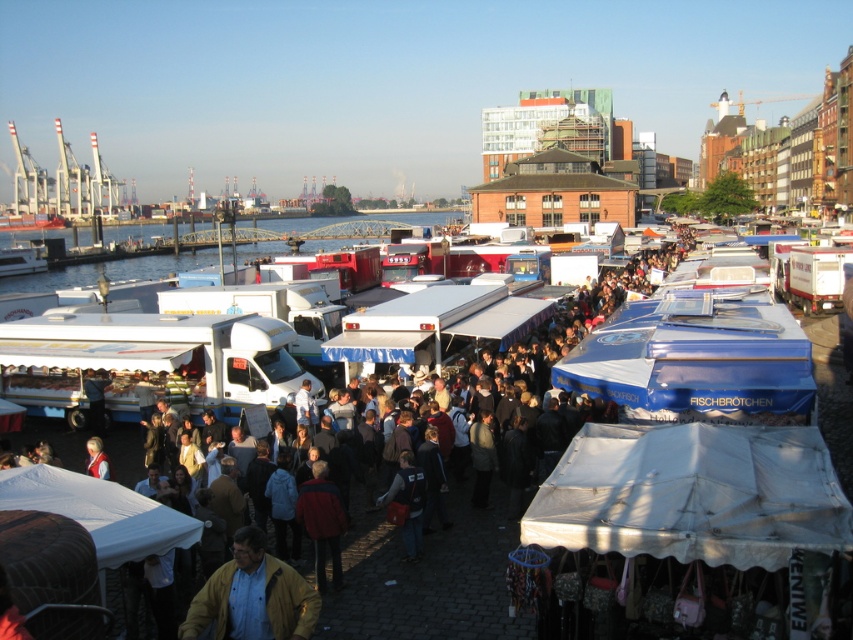
Where is `white fabric canopy at lower right`? This screenshot has width=853, height=640. white fabric canopy at lower right is located at coordinates (692, 493).

Is white fabric canopy at lower right to the right of red jacket at center from the viewer's perspective?

Yes, white fabric canopy at lower right is to the right of red jacket at center.

Where is `white fabric canopy at lower right`? Image resolution: width=853 pixels, height=640 pixels. white fabric canopy at lower right is located at coordinates (692, 493).

Does red jacket at center have a larger size compared to red wool sweater at lower left?

Yes, red jacket at center is bigger than red wool sweater at lower left.

Is red jacket at center positioned at the back of red wool sweater at lower left?

No.

You are a GUI agent. You are given a task and a screenshot of the screen. Output one action in this format:
    pyautogui.click(x=<x>, y=<y>)
    Task: Click on the red jacket at center
    The width and height of the screenshot is (853, 640).
    Given the screenshot: What is the action you would take?
    pyautogui.click(x=322, y=522)

Which of these two, white fabric canopy at lower right or matte yellow jacket at lower left, stands taller?

matte yellow jacket at lower left is taller.

Who is more distant from viewer, (579, 449) or (257, 596)?

Positioned behind is point (579, 449).

Image resolution: width=853 pixels, height=640 pixels. What are the coordinates of `white fabric canopy at lower right` in the screenshot? It's located at coord(692,493).